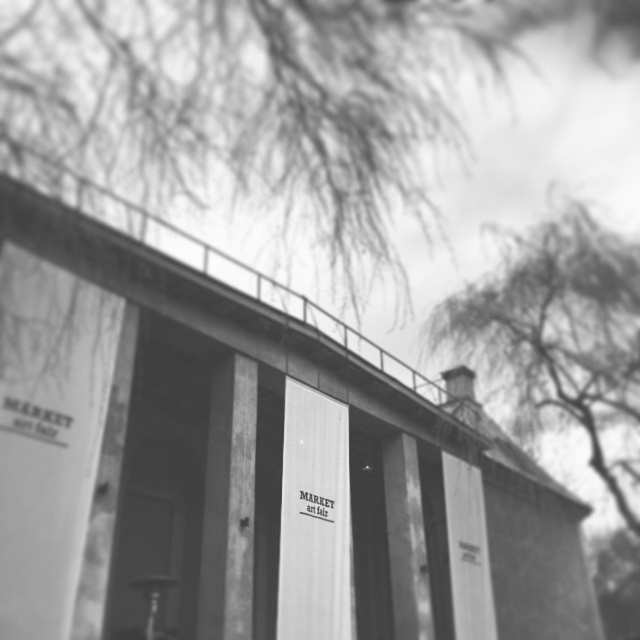
Looking at this image, you are a photographer standing on the smooth concrete bridge at center and want to capture the thin branches at upper right in your shot. Based on their widths, can you tell if the bridge will appear thicker than the branches in the photo?

The smooth concrete bridge at center might be wider than thin branches at upper right, so it is possible that the bridge will appear thicker than the branches in the photo.

You are a visitor at the art fair and see the smooth concrete bridge at center and the thin branches at upper right in the background. Which object is positioned to the right side of the other?

The smooth concrete bridge at center is to the left of thin branches at upper right, so the thin branches at upper right are positioned to the right side of the smooth concrete bridge at center.

You are a photographer standing in front of the building. You want to capture both the smooth concrete bridge at center and the thin branches at upper right in your shot. Which object will appear larger in the photo?

The smooth concrete bridge at center will appear larger in the photo because it is bigger than the thin branches at upper right.